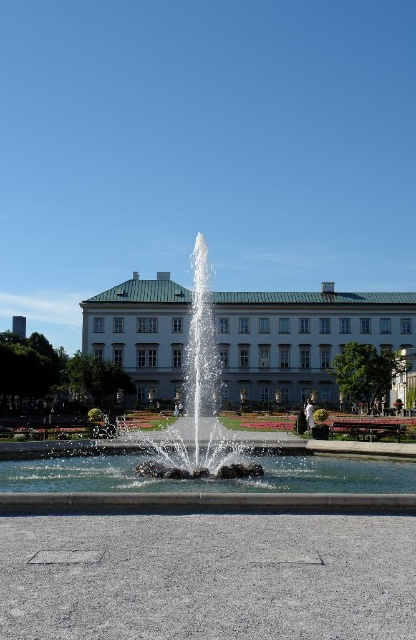
You are standing at the edge of the fountain and want to take a photo of the white smooth building at center. Based on your current position, where should you aim your camera to capture the building in the frame?

To capture the white smooth building at center in your photo, aim your camera towards the point at coordinates approximately 0.530 on the horizontal axis and 0.726 on the vertical axis, as this is the location of the building in the image.

You are standing in the garden and want to take a photo of both the white smooth building at center and the white stone fountain at center. Which object should you position closer to the left side of your camera frame to include both in the shot?

The white smooth building at center is positioned on the right side of the white stone fountain at center, so to include both in the shot, you should position the white stone fountain at center closer to the left side of your camera frame.